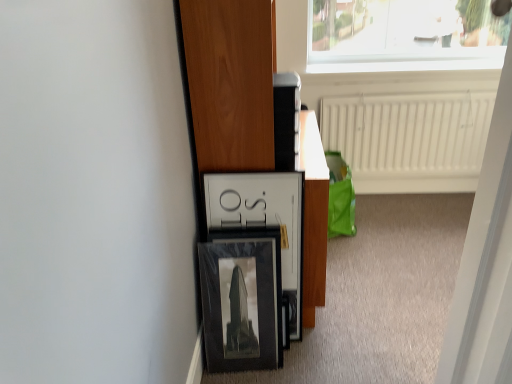
Question: Is there a large distance between white plastic screen door at upper right and white textured radiator at upper center?

Choices:
 (A) no
 (B) yes

Answer: (B)

Question: Considering the relative positions of white plastic screen door at upper right and white textured radiator at upper center in the image provided, is white plastic screen door at upper right to the left of white textured radiator at upper center from the viewer's perspective?

Choices:
 (A) yes
 (B) no

Answer: (A)

Question: Would you say white plastic screen door at upper right is outside white textured radiator at upper center?

Choices:
 (A) no
 (B) yes

Answer: (B)

Question: From the image's perspective, is white plastic screen door at upper right located beneath white textured radiator at upper center?

Choices:
 (A) yes
 (B) no

Answer: (A)

Question: Considering the relative positions of white plastic screen door at upper right and white textured radiator at upper center in the image provided, is white plastic screen door at upper right behind white textured radiator at upper center?

Choices:
 (A) no
 (B) yes

Answer: (A)

Question: Is white plastic screen door at upper right inside or outside of white textured radiator at upper center?

Choices:
 (A) outside
 (B) inside

Answer: (A)

Question: Considering the positions of point (487, 147) and point (474, 122), is point (487, 147) closer or farther from the camera than point (474, 122)?

Choices:
 (A) farther
 (B) closer

Answer: (B)

Question: Considering the positions of white plastic screen door at upper right and white textured radiator at upper center in the image, is white plastic screen door at upper right bigger or smaller than white textured radiator at upper center?

Choices:
 (A) small
 (B) big

Answer: (A)

Question: In the image, is white plastic screen door at upper right positioned in front of or behind white textured radiator at upper center?

Choices:
 (A) front
 (B) behind

Answer: (A)

Question: Considering their positions, is white plastic screen door at upper right located in front of or behind matte black frame at center?

Choices:
 (A) front
 (B) behind

Answer: (A)

Question: Is white plastic screen door at upper right bigger or smaller than matte black frame at center?

Choices:
 (A) big
 (B) small

Answer: (B)

Question: Would you say white plastic screen door at upper right is to the left or to the right of matte black frame at center in the picture?

Choices:
 (A) left
 (B) right

Answer: (B)

Question: From the image's perspective, is white plastic screen door at upper right located above or below matte black frame at center?

Choices:
 (A) above
 (B) below

Answer: (B)

Question: Considering their positions, is matte black frame at center located in front of or behind white plastic screen door at upper right?

Choices:
 (A) behind
 (B) front

Answer: (A)

Question: From a real-world perspective, relative to white plastic screen door at upper right, is matte black frame at center vertically above or below?

Choices:
 (A) below
 (B) above

Answer: (A)